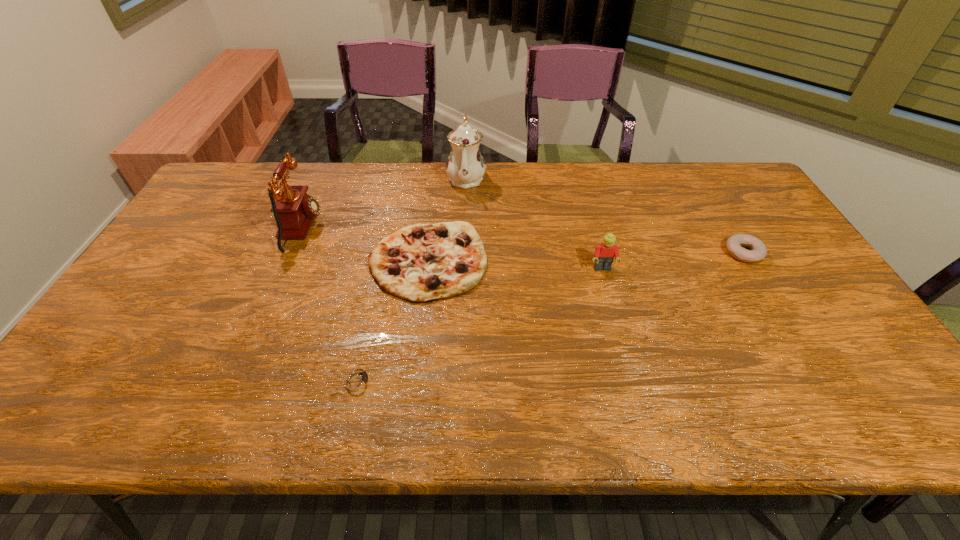
Where is `free area in between the leftmost object and the nearest object`? The width and height of the screenshot is (960, 540). free area in between the leftmost object and the nearest object is located at coordinates 330,304.

Where is `vacant space that is in between the pizza and the nearest object`? vacant space that is in between the pizza and the nearest object is located at coordinates (394, 320).

Select which object is the fifth closest to the pizza. Please provide its 2D coordinates. Your answer should be formatted as a tuple, i.e. [(x, y)], where the tuple contains the x and y coordinates of a point satisfying the conditions above.

[(758, 251)]

Identify which object is located as the third nearest to the shortest object. Please provide its 2D coordinates. Your answer should be formatted as a tuple, i.e. [(x, y)], where the tuple contains the x and y coordinates of a point satisfying the conditions above.

[(604, 255)]

I want to click on vacant area that satisfies the following two spatial constraints: 1. on the face of the Lego; 2. on the face of the nearest object, so click(633, 380).

The height and width of the screenshot is (540, 960). Identify the location of vacant region that satisfies the following two spatial constraints: 1. on the dial of the leftmost object; 2. on the right side of the rightmost object. (292, 253).

The width and height of the screenshot is (960, 540). I want to click on vacant space that satisfies the following two spatial constraints: 1. on the front side of the doughnut; 2. on the face of the nearest object, so click(x=821, y=380).

Where is `vacant space that satisfies the following two spatial constraints: 1. on the front side of the rightmost object; 2. on the face of the shortest object`? vacant space that satisfies the following two spatial constraints: 1. on the front side of the rightmost object; 2. on the face of the shortest object is located at coordinates (821, 380).

I want to click on free space that satisfies the following two spatial constraints: 1. on the dial of the leftmost object; 2. on the left side of the doughnut, so click(x=292, y=253).

Identify the location of vacant area in the image that satisfies the following two spatial constraints: 1. on the back side of the pizza; 2. on the left side of the chinaware. (439, 178).